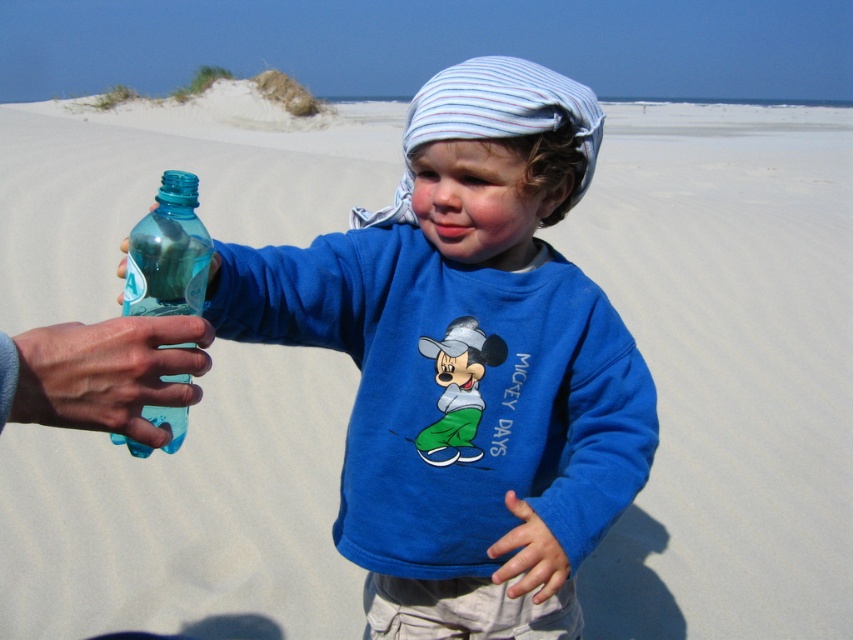
You are a photographer trying to capture the translucent plastic hand at lower left and the translucent plastic bottle at left in the same frame. Which object should you focus on first to ensure both are in focus?

You should focus on the translucent plastic hand at lower left first because it is closer to the camera than the translucent plastic bottle at left. By focusing on the closer object, the background object will still be in focus due to the depth of field.

You are a photographer trying to capture the two points in the image. Which point, point [119,432] or point [178,209], will appear larger in your photo?

Point [119,432] is closer to the camera than point [178,209], so it will appear larger in the photo.

You are a photographer capturing this beach scene. You notice the smooth skin hand at lower center and the transparent plastic bottle at left. Which object appears narrower in the photo?

The smooth skin hand at lower center has a lesser width compared to the transparent plastic bottle at left, so it appears narrower in the photo.